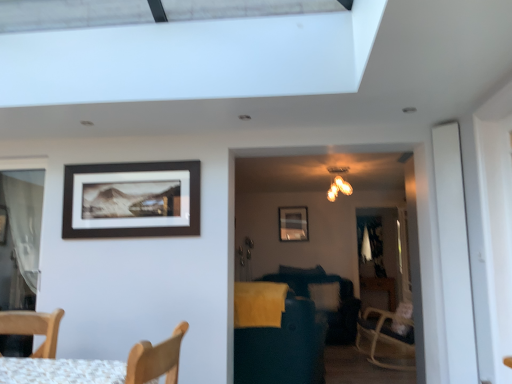
Find the location of `blank space situated above matte black picture frame at upper center, which ranks as the 1th picture frame in right-to-left order (from a real-world perspective)`. blank space situated above matte black picture frame at upper center, which ranks as the 1th picture frame in right-to-left order (from a real-world perspective) is located at coordinates click(298, 201).